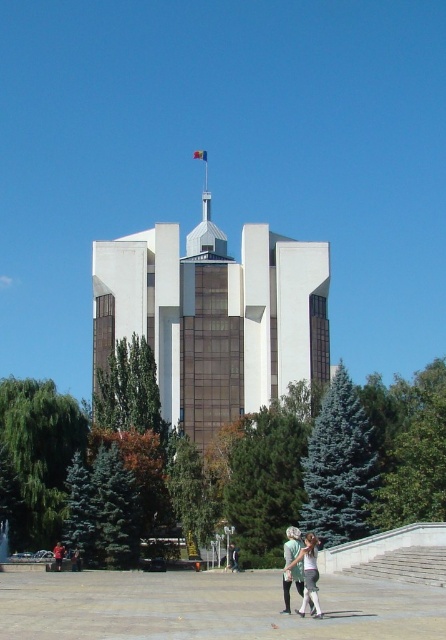
Does white glass building at center appear on the right side of white cotton shirt at lower center?

No, white glass building at center is not to the right of white cotton shirt at lower center.

Is white glass building at center to the left of white cotton shirt at lower center from the viewer's perspective?

Indeed, white glass building at center is positioned on the left side of white cotton shirt at lower center.

Find the location of a particular element. The height and width of the screenshot is (640, 446). white glass building at center is located at coordinates (214, 316).

Locate an element on the screen. The height and width of the screenshot is (640, 446). white glass building at center is located at coordinates (214, 316).